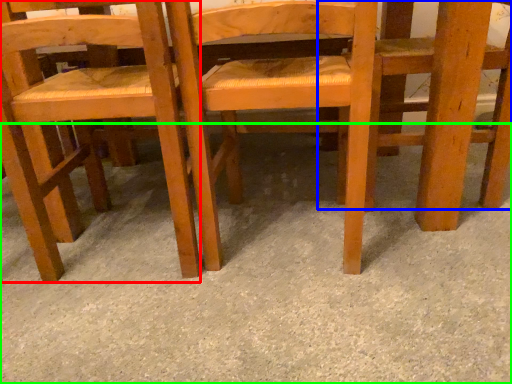
Question: Based on their relative distances, which object is nearer to chair (highlighted by a red box)? Choose from chair (highlighted by a blue box) and concrete (highlighted by a green box).

Choices:
 (A) chair
 (B) concrete

Answer: (B)